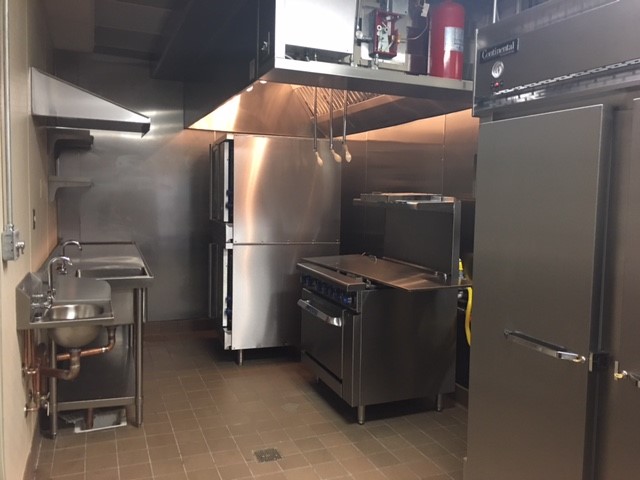
Locate an element on the screen. The image size is (640, 480). ceiling is located at coordinates (118, 21).